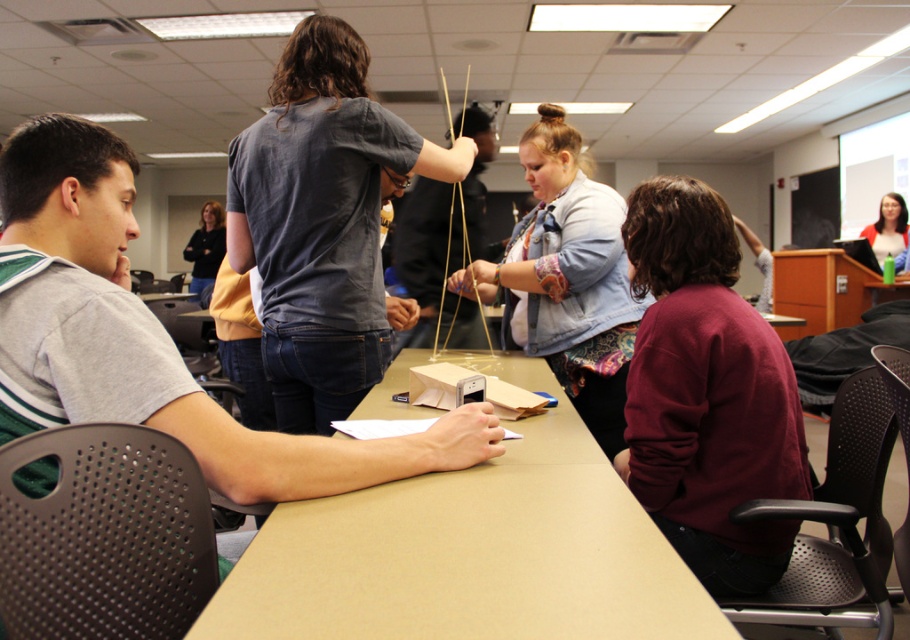
Question: Which point is closer to the camera?

Choices:
 (A) (689, 333)
 (B) (901, 250)
 (C) (564, 168)
 (D) (386, 451)

Answer: (D)

Question: Which object is the closest to the maroon sweater at lower right?

Choices:
 (A) dark brown hair at upper left
 (B) light brown wood table at center
 (C) gray cotton shirt at left

Answer: (B)

Question: Is denim jacket at center behind matte black jacket at upper right?

Choices:
 (A) no
 (B) yes

Answer: (A)

Question: Is light brown wood table at center above denim jacket at center?

Choices:
 (A) yes
 (B) no

Answer: (B)

Question: Can you confirm if matte black jacket at upper right is smaller than natural wood chopsticks at center?

Choices:
 (A) no
 (B) yes

Answer: (A)

Question: Which of the following is the closest to the observer?

Choices:
 (A) dark gray t-shirt at center
 (B) natural wood chopsticks at center

Answer: (A)